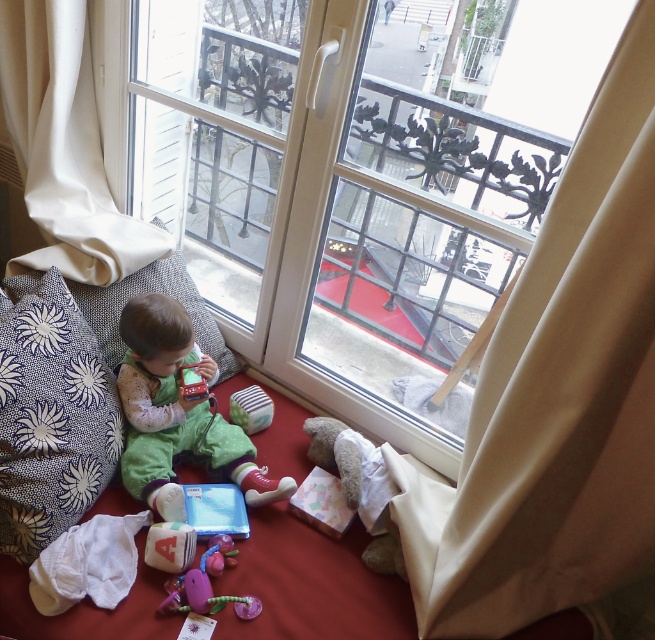
Question: Which of the following is the farthest from the observer?

Choices:
 (A) (181, 596)
 (B) (240, 273)

Answer: (B)

Question: Considering the real-world distances, which object is closest to the rubberized plastic rattle at lower center?

Choices:
 (A) blue printed fabric pillow at lower left
 (B) transparent glass window at center
 (C) purple rubber teething toy at center
 (D) green soft fabric toddler at lower left

Answer: (C)

Question: Is purple rubber teething toy at center bigger than rubberized plastic rattle at lower center?

Choices:
 (A) no
 (B) yes

Answer: (B)

Question: Which object is closer to the camera taking this photo?

Choices:
 (A) beige fabric curtain at right
 (B) white fabric curtain at upper left
 (C) blue printed fabric pillow at lower left
 (D) transparent glass window at center

Answer: (A)

Question: Does beige fabric curtain at right appear on the right side of blue printed fabric pillow at lower left?

Choices:
 (A) no
 (B) yes

Answer: (B)

Question: Is transparent glass window at center closer to the viewer compared to white fabric curtain at upper left?

Choices:
 (A) yes
 (B) no

Answer: (A)